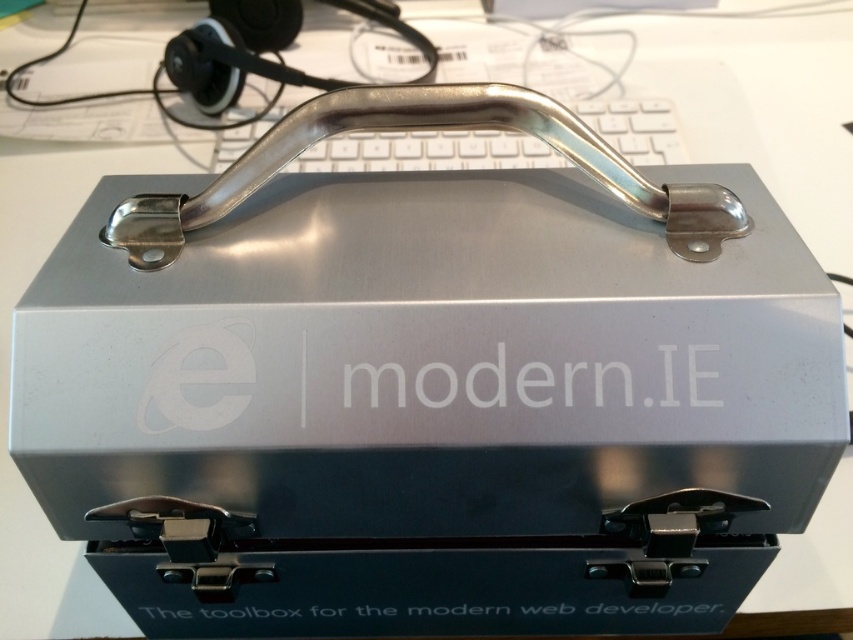
Question: Which object is farther from the camera taking this photo?

Choices:
 (A) white plastic keyboard at center
 (B) matte black earphone at upper left

Answer: (B)

Question: In this image, where is white plastic keyboard at center located relative to matte black earphone at upper left?

Choices:
 (A) right
 (B) left

Answer: (A)

Question: Can you confirm if white plastic keyboard at center is positioned to the left of matte black earphone at upper left?

Choices:
 (A) yes
 (B) no

Answer: (B)

Question: Does white plastic keyboard at center appear on the right side of matte black earphone at upper left?

Choices:
 (A) yes
 (B) no

Answer: (A)

Question: Which of the following is the closest to the observer?

Choices:
 (A) (236, 145)
 (B) (212, 60)

Answer: (A)